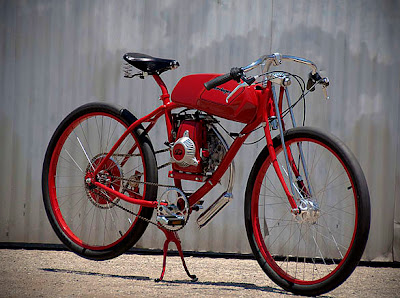
The width and height of the screenshot is (400, 298). Find the location of `wall`. wall is located at coordinates (174, 27).